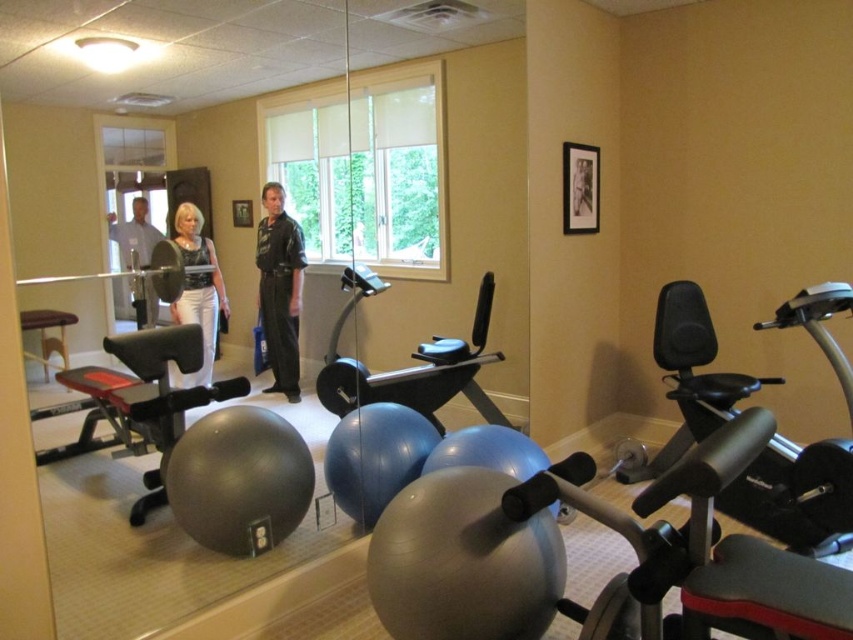
Looking at this image, you are standing in the gym and want to reach a specific point marked as point (173, 435). If you are currently 2 meters away from that point, how much further do you need to move to reach it?

The point (173, 435) is 2.32 meters from the viewer. Since you are currently 2 meters away, you need to move an additional 0.32 meters to reach it.

You are standing at the entrance of the gym and want to place a new yoga mat exactly where the matte gray exercise ball at center is currently located. According to the gym layout, is this position suitable for placing the yoga mat?

The matte gray exercise ball at center is positioned at coordinates point (149, 396), so placing the yoga mat there would be possible as long as the coordinates align with the gym layout. However, since the ball is already there, you might need to move it first.

You are an athlete preparing for a workout and see the matte gray exercise ball at center and the matte black exercise ball at center in the gym. Which one is positioned lower in the image?

The matte gray exercise ball at center is positioned lower than the matte black exercise ball at center in the image.